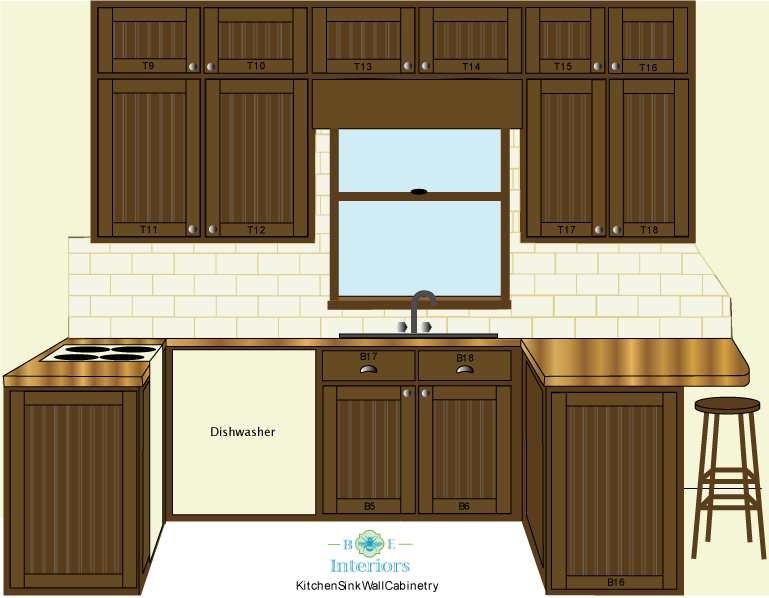
This screenshot has height=598, width=769. I want to click on stove, so click(x=142, y=356).